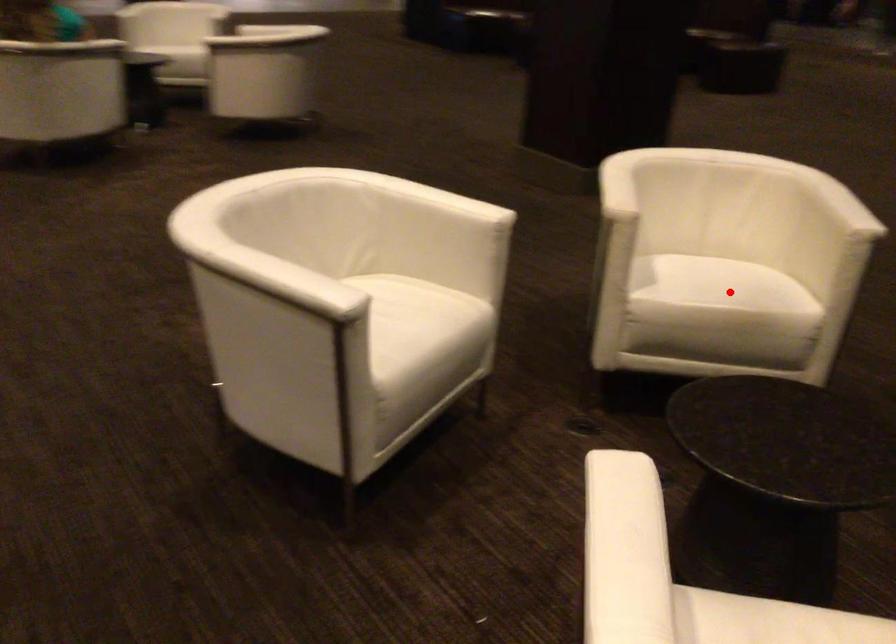
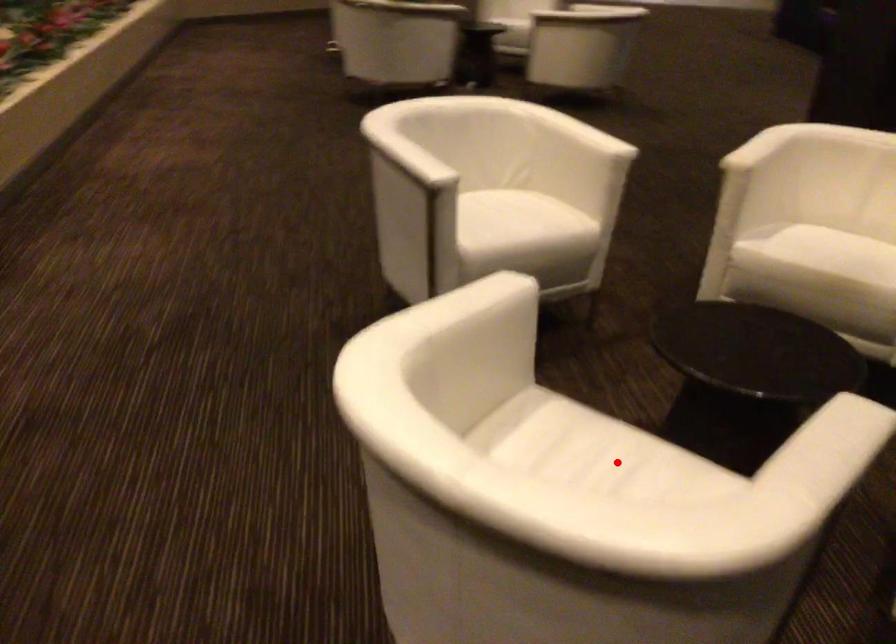
I am providing you with two images of the same scene from different viewpoints. A red point is marked on the first image and another point is marked on the second image. Is the red point in image1 aligned with the point shown in image2?

No